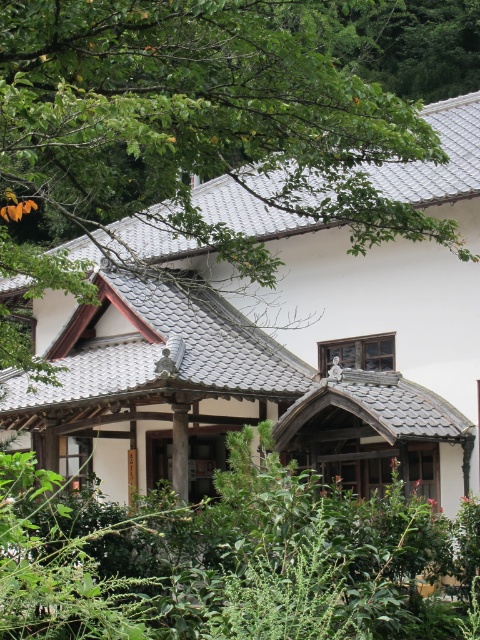
You are standing in front of the traditional Japanese building and notice the green leafy tree at upper left and the green leafy bush at center. Which one is taller?

The green leafy tree at upper left is much taller than the green leafy bush at center.